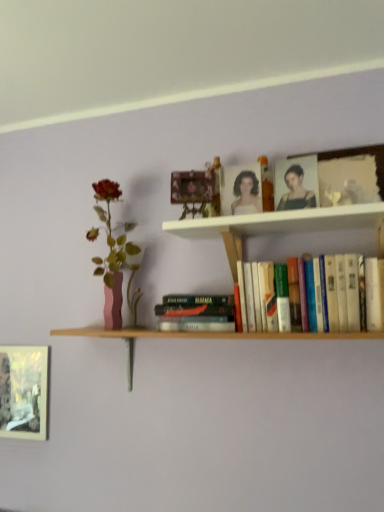
Question: Are white wooden shelf at upper center and matte pink vase at left beside each other?

Choices:
 (A) yes
 (B) no

Answer: (B)

Question: Can you confirm if white wooden shelf at upper center is positioned to the left of matte pink vase at left?

Choices:
 (A) yes
 (B) no

Answer: (B)

Question: Is matte pink vase at left completely or partially inside white wooden shelf at upper center?

Choices:
 (A) yes
 (B) no

Answer: (B)

Question: Does white wooden shelf at upper center have a larger size compared to matte pink vase at left?

Choices:
 (A) yes
 (B) no

Answer: (A)

Question: Is white wooden shelf at upper center oriented away from matte pink vase at left?

Choices:
 (A) yes
 (B) no

Answer: (B)

Question: Is metallic silver frame at lower left, arranged as the second picture frame when viewed from the top, to the left or to the right of matte black portrait at upper center in the image?

Choices:
 (A) right
 (B) left

Answer: (B)

Question: Considering the positions of metallic silver frame at lower left, which is counted as the 2th picture frame, starting from the right, and matte black portrait at upper center in the image, is metallic silver frame at lower left, which is counted as the 2th picture frame, starting from the right, taller or shorter than matte black portrait at upper center?

Choices:
 (A) short
 (B) tall

Answer: (B)

Question: Is metallic silver frame at lower left, the first picture frame viewed from the back, inside or outside of matte black portrait at upper center?

Choices:
 (A) outside
 (B) inside

Answer: (A)

Question: From the image's perspective, is metallic silver frame at lower left, which is counted as the 2th picture frame, starting from the right, located above or below matte black portrait at upper center?

Choices:
 (A) above
 (B) below

Answer: (B)

Question: Considering the positions of hardcover book at center, the second book in the right-to-left sequence, and metallic silver frame at lower left, which is counted as the 2th picture frame, starting from the front, in the image, is hardcover book at center, the second book in the right-to-left sequence, bigger or smaller than metallic silver frame at lower left, which is counted as the 2th picture frame, starting from the front,?

Choices:
 (A) small
 (B) big

Answer: (B)

Question: Relative to metallic silver frame at lower left, arranged as the second picture frame when viewed from the top, is hardcover book at center, the second book in the right-to-left sequence, in front or behind?

Choices:
 (A) behind
 (B) front

Answer: (B)

Question: From their relative heights in the image, would you say hardcover book at center, acting as the 1th book starting from the left, is taller or shorter than metallic silver frame at lower left, arranged as the second picture frame when viewed from the top?

Choices:
 (A) short
 (B) tall

Answer: (A)

Question: Choose the correct answer: Is hardcover book at center, acting as the 1th book starting from the left, inside metallic silver frame at lower left, the first picture frame from the left, or outside it?

Choices:
 (A) outside
 (B) inside

Answer: (A)

Question: Is point (97, 187) positioned closer to the camera than point (175, 222)?

Choices:
 (A) closer
 (B) farther

Answer: (B)

Question: From the image's perspective, is matte pink vase at left positioned above or below white wooden shelf at upper center?

Choices:
 (A) above
 (B) below

Answer: (B)